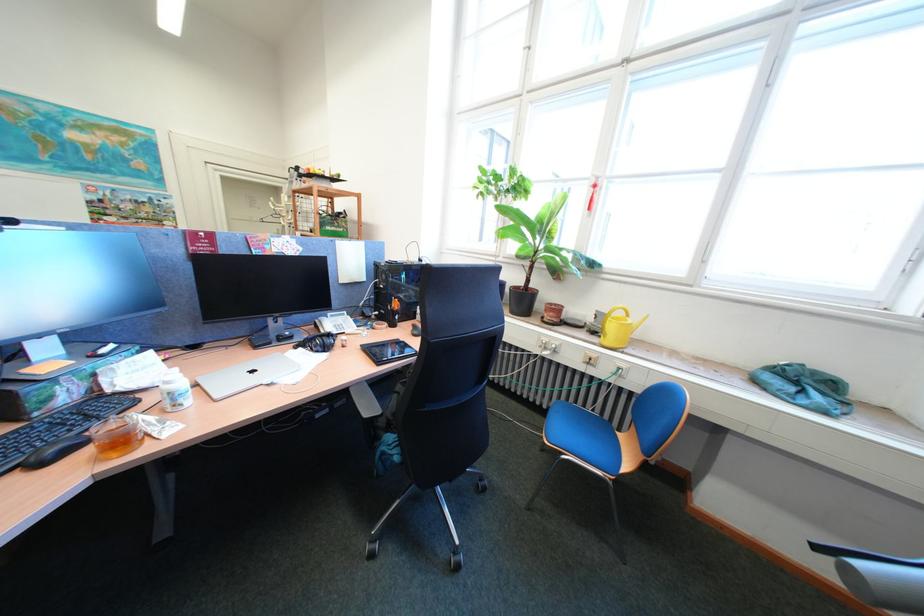
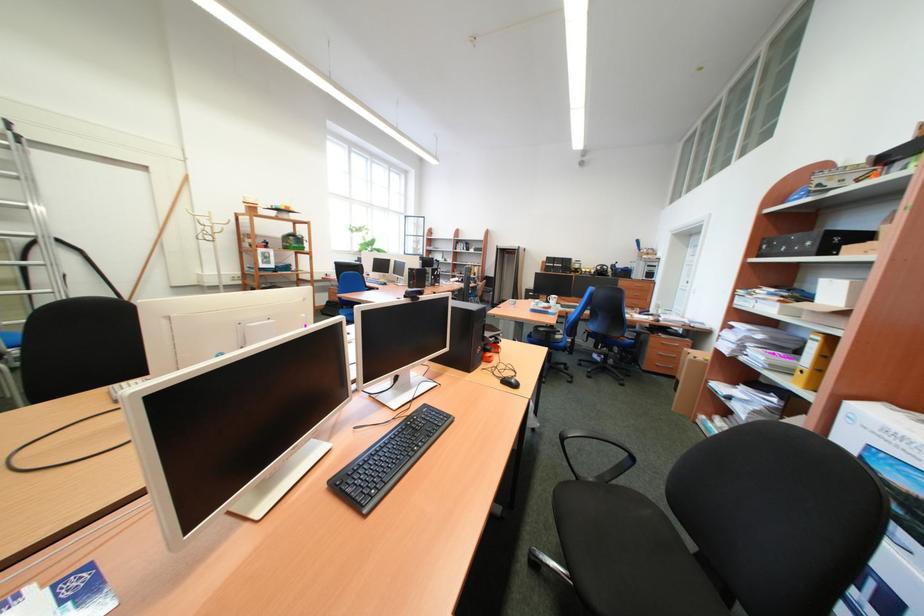
Question: I am providing you with two images of the same scene from different viewpoints. Which of the following objects are not visible in image2?

Choices:
 (A) black computer mouse
 (B) cabinet drawer handle
 (C) blue chair sitting surface
 (D) blue faucet handle

Answer: (C)